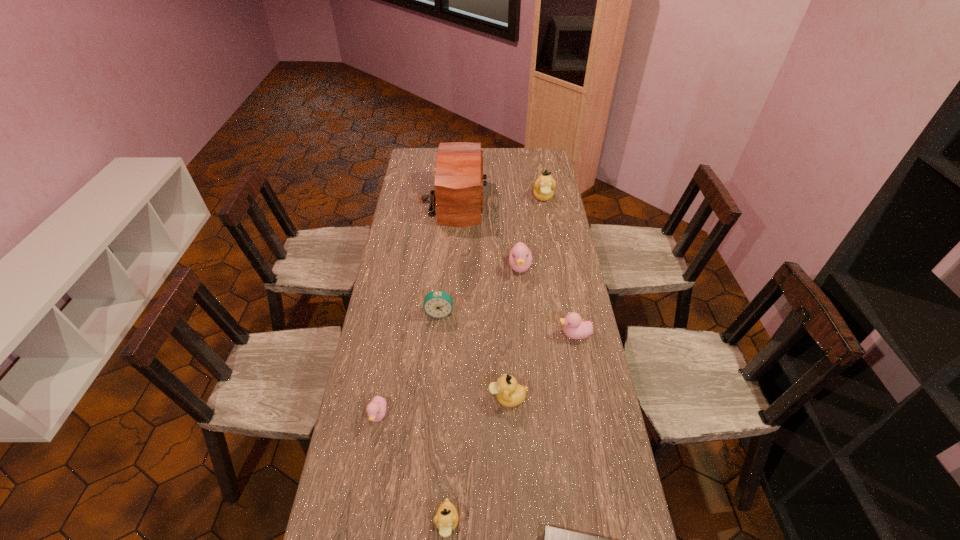
The width and height of the screenshot is (960, 540). In order to click on the tallest object in this screenshot , I will do `click(458, 184)`.

Where is `the farthest tan duckling`? the farthest tan duckling is located at coordinates click(544, 186).

Where is `the rightmost tan duckling`? the rightmost tan duckling is located at coordinates (x=544, y=186).

This screenshot has width=960, height=540. What are the coordinates of `the fifth nearest duckling` in the screenshot? It's located at (520, 259).

Find the location of a particular element. This screenshot has height=540, width=960. the biggest pink duckling is located at coordinates (520, 259).

The height and width of the screenshot is (540, 960). What are the coordinates of `the second biggest tan duckling` in the screenshot? It's located at (509, 393).

I want to click on the second farthest tan duckling, so tap(509, 393).

Locate an element on the screen. The image size is (960, 540). the fourth farthest object is located at coordinates (438, 304).

Where is `alarm clock`? Image resolution: width=960 pixels, height=540 pixels. alarm clock is located at coordinates (438, 304).

Where is `the rightmost pink duckling`? the rightmost pink duckling is located at coordinates (575, 328).